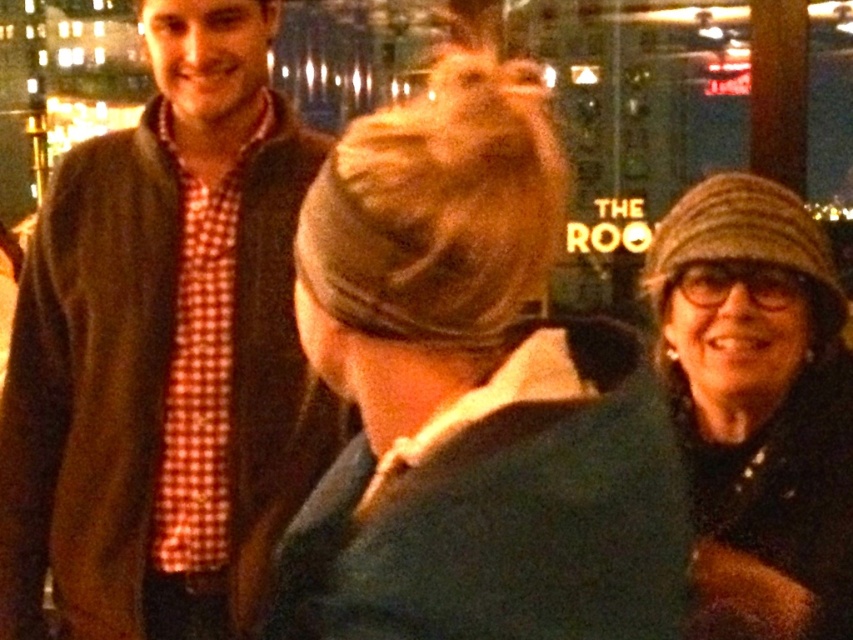
You are a photographer at THE ROO venue, and you need to capture a wide shot of the entire scene. The camera you are using has a maximum focus range of 5 meters. Can you capture both the dark green fabric coat at center and the striped wool hat at right in focus without moving the camera?

The dark green fabric coat at center and the striped wool hat at right are 5.25 meters apart. Since the camera can only focus up to 5 meters, the distance between them exceeds the focus range. Therefore, you cannot capture both in focus without moving the camera.

You are standing behind the group at THE ROO venue and want to hand a drink to both the person wearing the dark green fabric coat at center and the person wearing the matte brown jacket at left. Which person should you approach first based on their proximity to you?

You should approach the dark green fabric coat at center first because it is closer to the viewer than the matte brown jacket at left.

You are a photographer at the event and need to ensure that both the matte brown jacket at left and the striped wool hat at right are clearly visible in your photo. Given that your camera can only focus on objects wider than 15 cm, will both items meet this requirement?

The matte brown jacket at left is wider than the striped wool hat at right. Since the camera requires objects wider than 15 cm to focus, and the matte brown jacket at left is wider than the striped wool hat at right, it is possible that both items meet the requirement. However, without knowing the exact width of the striped wool hat at right, we cannot be certain. The matte brown jacket at left definitely meets the requirement, but the striped wool hat at right might not if its width is under 15 cm.